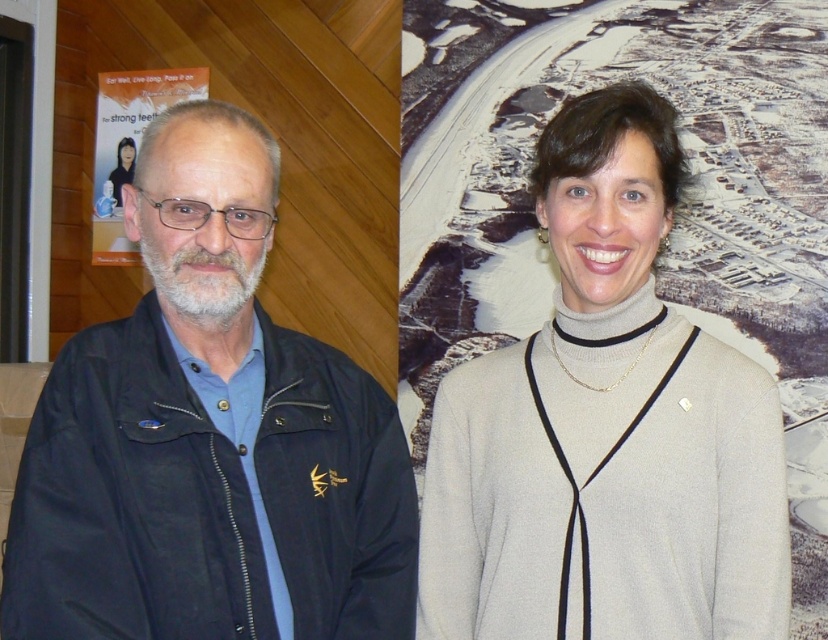
Question: Among these objects, which one is nearest to the camera?

Choices:
 (A) light gray sweater at center
 (B) matte paper poster at upper left
 (C) black matte jacket at left

Answer: (C)

Question: Is light gray sweater at center thinner than matte paper poster at upper left?

Choices:
 (A) yes
 (B) no

Answer: (B)

Question: Estimate the real-world distances between objects in this image. Which object is farther from the matte paper poster at upper left?

Choices:
 (A) black matte jacket at left
 (B) smooth black hair at upper left
 (C) light gray sweater at center

Answer: (C)

Question: Observing the image, what is the correct spatial positioning of black matte jacket at left in reference to matte paper poster at upper left?

Choices:
 (A) below
 (B) above

Answer: (A)

Question: Which point is closer to the camera taking this photo?

Choices:
 (A) (138, 145)
 (B) (634, 152)

Answer: (B)

Question: Is black matte jacket at left smaller than matte paper poster at upper left?

Choices:
 (A) no
 (B) yes

Answer: (A)